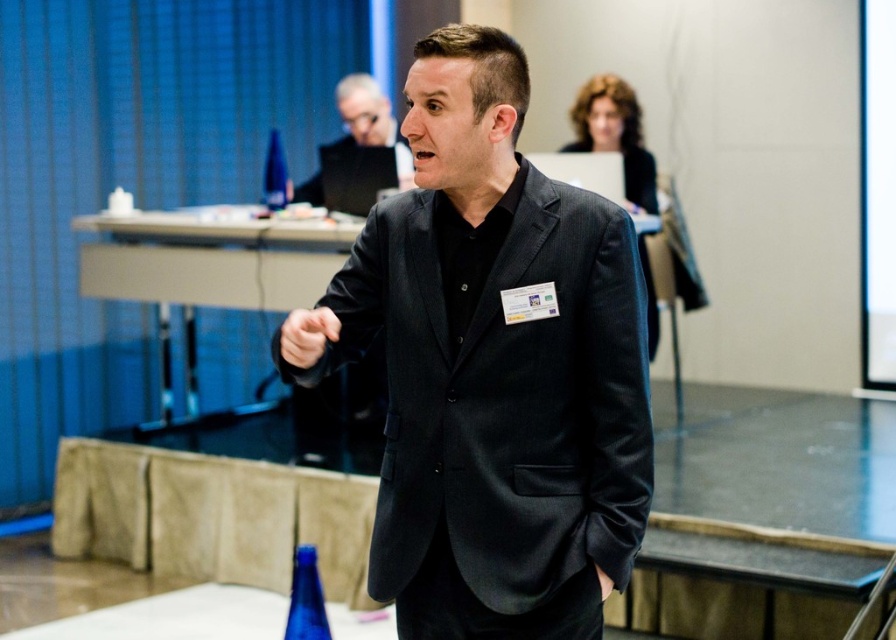
Between matte black suit at center and black matte suit at center, which one appears on the left side from the viewer's perspective?

Positioned to the left is black matte suit at center.

Is point (403, 508) less distant than point (363, 140)?

That is True.

What are the coordinates of `matte black suit at center` in the screenshot? It's located at (492, 365).